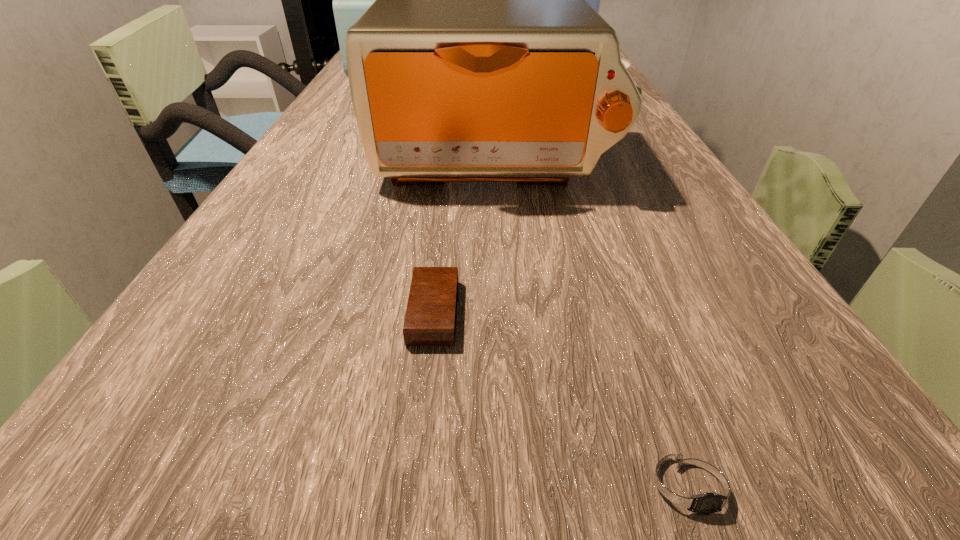
Locate an element on the screen. Image resolution: width=960 pixels, height=540 pixels. free point at the left edge is located at coordinates (328, 189).

In the image, there is a desktop. Identify the location of free region at the right edge. This screenshot has width=960, height=540. (686, 224).

You are a GUI agent. You are given a task and a screenshot of the screen. Output one action in this format:
    pyautogui.click(x=<x>, y=<y>)
    Task: Click on the free region at the near right corner of the desktop
    This screenshot has width=960, height=540.
    Given the screenshot: What is the action you would take?
    pyautogui.click(x=833, y=504)

Where is `vacant space that's between the alarm clock and the tallest object`? vacant space that's between the alarm clock and the tallest object is located at coordinates (492, 183).

Where is `object that is the third closest one to the nearest object`? This screenshot has width=960, height=540. object that is the third closest one to the nearest object is located at coordinates (627, 64).

Point out which object is positioned as the fifth nearest to the toaster oven. Please provide its 2D coordinates. Your answer should be formatted as a tuple, i.e. [(x, y)], where the tuple contains the x and y coordinates of a point satisfying the conditions above.

[(594, 0)]

At what (x,y) coordinates should I click in order to perform the action: click on vacant region that satisfies the following two spatial constraints: 1. on the side of the water jug with the handle; 2. on the front face of the alarm clock. Please return your answer as a coordinate pair (x, y). The image size is (960, 540). Looking at the image, I should click on (662, 312).

Where is `vacant space that satisfies the following two spatial constraints: 1. on the front panel of the soup bowl; 2. on the left side of the third tallest object`? vacant space that satisfies the following two spatial constraints: 1. on the front panel of the soup bowl; 2. on the left side of the third tallest object is located at coordinates (390, 92).